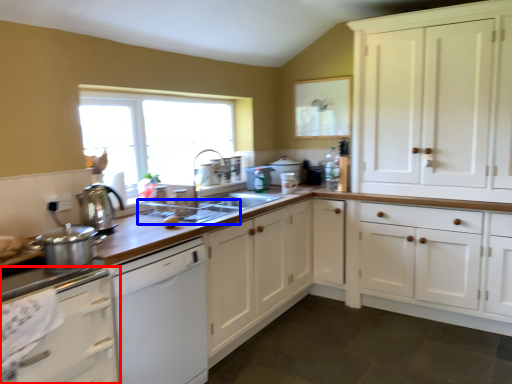
Question: Among these objects, which one is farthest to the camera, cabinetry (highlighted by a red box) or appliance (highlighted by a blue box)?

Choices:
 (A) cabinetry
 (B) appliance

Answer: (B)